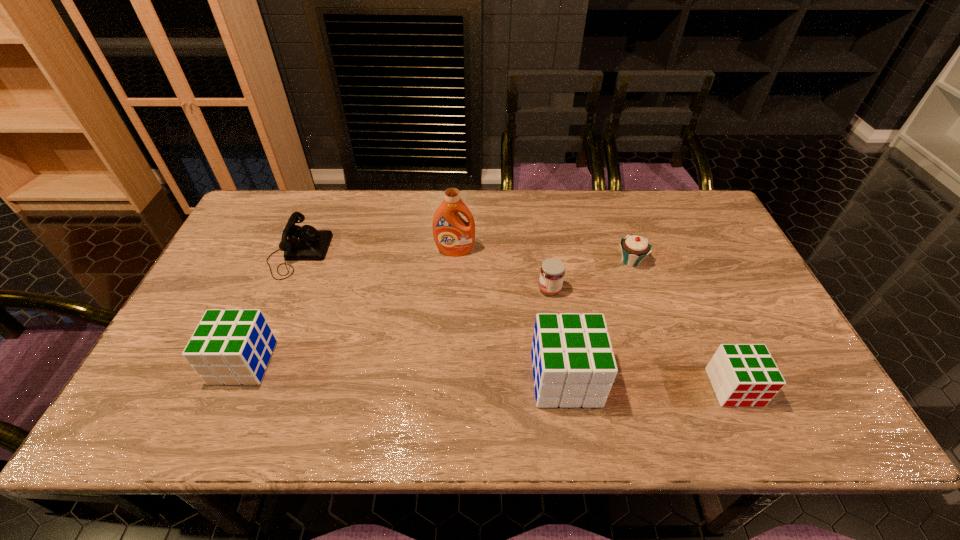
To achieve uniform spacing by inserting another cube among them, please point to a free space for this new cube. Please provide its 2D coordinates. Your answer should be formatted as a tuple, i.e. [(x, y)], where the tuple contains the x and y coordinates of a point satisfying the conditions above.

[(402, 370)]